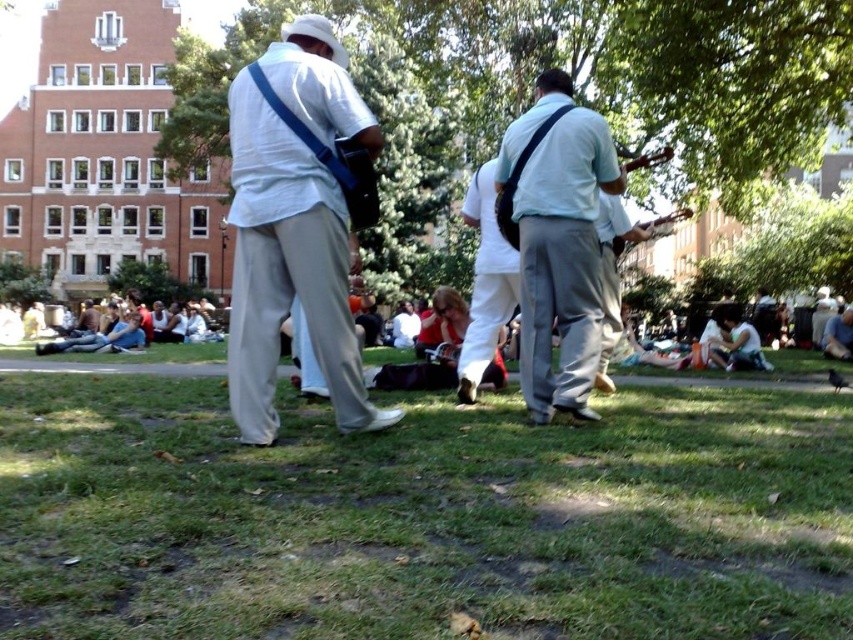
Question: Considering the relative positions of white matte shirt at center and white cotton shirt at center in the image provided, where is white matte shirt at center located with respect to white cotton shirt at center?

Choices:
 (A) below
 (B) above

Answer: (B)

Question: Does green leafy tree at center lie behind white cotton shirt at center?

Choices:
 (A) yes
 (B) no

Answer: (A)

Question: Which object appears farthest from the camera in this image?

Choices:
 (A) green leafy tree at center
 (B) light blue fabric guitar at center

Answer: (A)

Question: Which point is farther from the camera taking this photo?

Choices:
 (A) (509, 304)
 (B) (526, 342)

Answer: (A)

Question: Is green grass at lower center to the left of matte brown guitar at center from the viewer's perspective?

Choices:
 (A) no
 (B) yes

Answer: (B)

Question: Which object is farther from the camera taking this photo?

Choices:
 (A) green leafy tree at center
 (B) white matte shirt at center
 (C) white cotton shirt at center
 (D) light blue fabric guitar at center

Answer: (A)